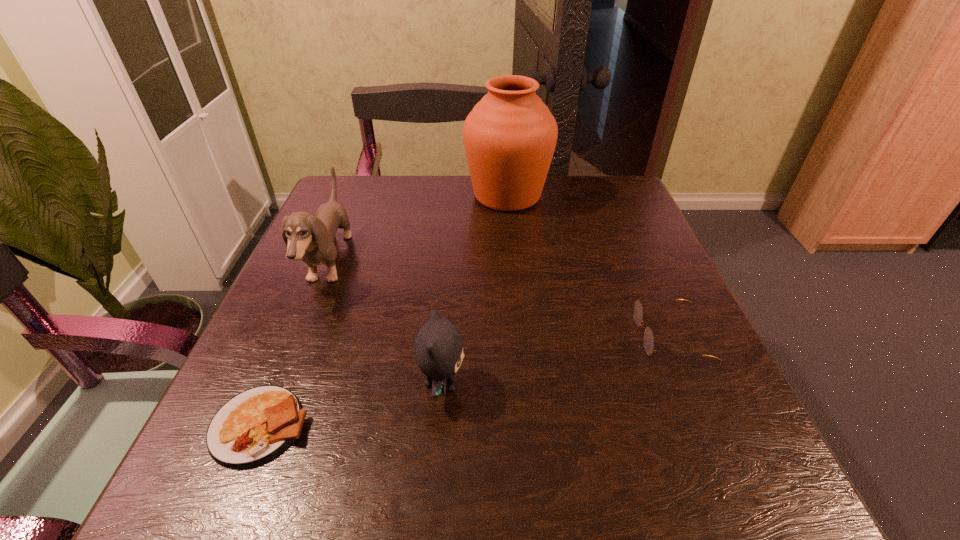
The height and width of the screenshot is (540, 960). Identify the location of free space located on the temples of the spectacles. (447, 336).

The image size is (960, 540). I want to click on vacant space located 0.210m on the temples of the spectacles, so click(516, 336).

Locate an element on the screen. This screenshot has height=540, width=960. free spot located on the temples of the spectacles is located at coordinates (488, 336).

Identify the location of free space located on the back of the omelet. This screenshot has height=540, width=960. (322, 275).

You are a GUI agent. You are given a task and a screenshot of the screen. Output one action in this format:
    pyautogui.click(x=<x>, y=<y>)
    Task: Click on the urn situated at the far edge
    The height and width of the screenshot is (540, 960).
    Given the screenshot: What is the action you would take?
    pyautogui.click(x=510, y=135)

Find the location of a particular element. This screenshot has width=960, height=540. puppy present at the far edge is located at coordinates (311, 238).

At what (x,y) coordinates should I click in order to perform the action: click on object at the near edge. Please return your answer as a coordinate pair (x, y). Looking at the image, I should click on (256, 425).

This screenshot has width=960, height=540. In order to click on puppy located at the left edge in this screenshot , I will do `click(311, 238)`.

At what (x,y) coordinates should I click in order to perform the action: click on omelet present at the left edge. Please return your answer as a coordinate pair (x, y). Looking at the image, I should click on (256, 425).

Locate an element on the screen. The image size is (960, 540). object positioned at the right edge is located at coordinates (648, 338).